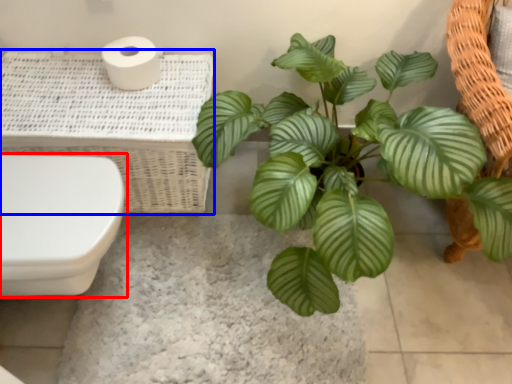
Question: Among these objects, which one is nearest to the camera, toilet (highlighted by a red box) or basket (highlighted by a blue box)?

Choices:
 (A) toilet
 (B) basket

Answer: (A)